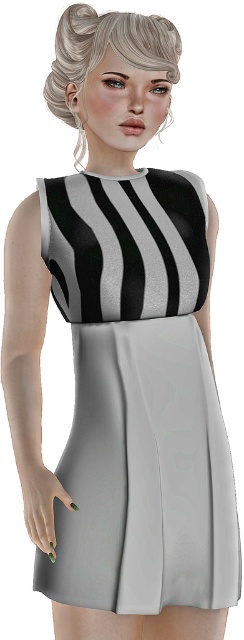
Between blonde hair at upper center and green matte nails at lower left, which one appears on the left side from the viewer's perspective?

Positioned to the left is green matte nails at lower left.

Between blonde hair at upper center and green matte nails at lower left, which one has less height?

blonde hair at upper center is shorter.

This screenshot has height=640, width=244. I want to click on blonde hair at upper center, so click(103, 52).